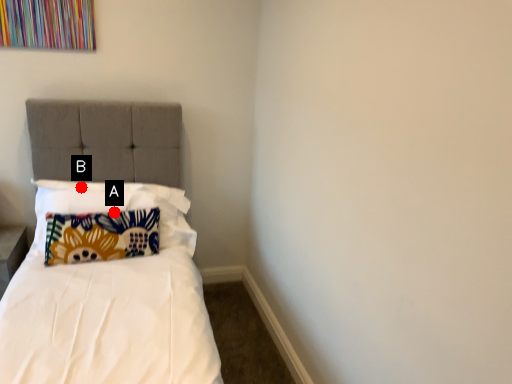
Question: Two points are circled on the image, labeled by A and B beside each circle. Which point is closer to the camera?

Choices:
 (A) A is closer
 (B) B is closer

Answer: (A)